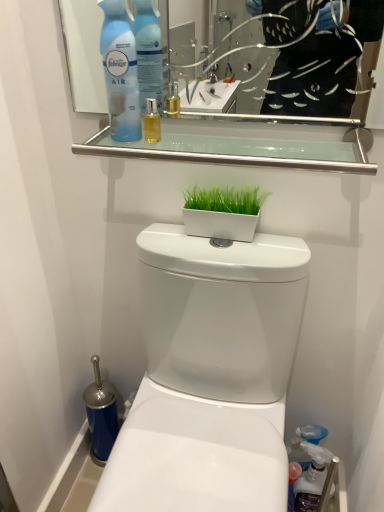
Question: Considering the positions of translucent plastic spray bottle at lower right, which is counted as the 2th cleaning product, starting from the front, and clear glass shelf at upper center in the image, is translucent plastic spray bottle at lower right, which is counted as the 2th cleaning product, starting from the front, bigger or smaller than clear glass shelf at upper center?

Choices:
 (A) big
 (B) small

Answer: (A)

Question: Is point pyautogui.click(x=304, y=483) positioned closer to the camera than point pyautogui.click(x=327, y=159)?

Choices:
 (A) farther
 (B) closer

Answer: (A)

Question: Which of these objects is positioned farthest from the white glossy flowerpot at center?

Choices:
 (A) white glossy toilet at center
 (B) translucent plastic spray bottle at lower right, placed as the first cleaning product when sorted from back to front
 (C) clear glass shelf at upper center
 (D) blue plastic air freshener at upper left, which is the 2th cleaning product in bottom-to-top order

Answer: (B)

Question: Which object is the closest to the blue plastic air freshener at upper left, which is the 2th cleaning product in bottom-to-top order?

Choices:
 (A) white glossy flowerpot at center
 (B) clear glass shelf at upper center
 (C) white glossy toilet at center
 (D) translucent plastic spray bottle at lower right, the 2th cleaning product positioned from the top

Answer: (B)